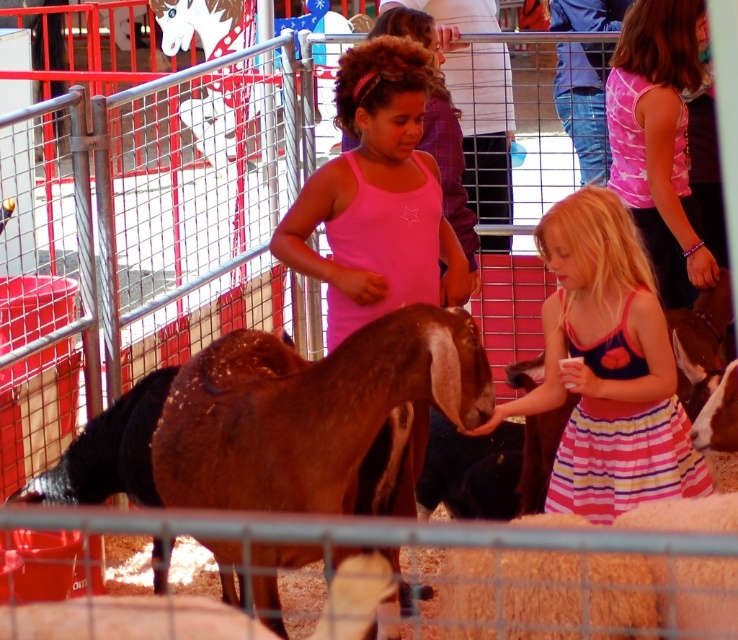
You are a photographer trying to capture a photo of the striped cotton dress at lower right and the brown woolen sheep at center. Which object is wider when viewed from your position?

The striped cotton dress at lower right is wider than the brown woolen sheep at center.

You are a parent trying to take a photo of your child wearing the striped cotton dress at lower right. You want to ensure the fuzzy orange sheep at lower center isn

The fuzzy orange sheep at lower center is behind the striped cotton dress at lower right, so positioning the child in front of the sheep would hide the sheep in the background, making it less noticeable in the photo.